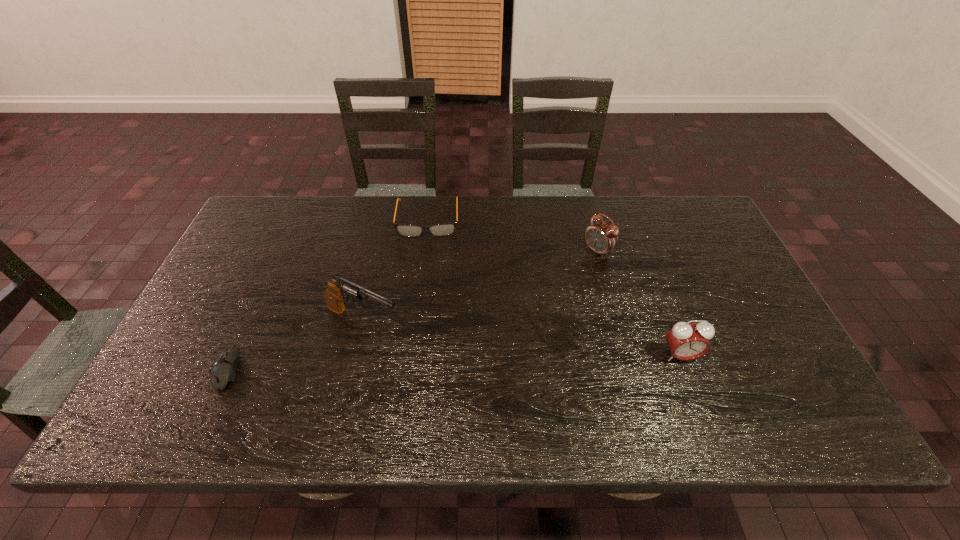
You are a GUI agent. You are given a task and a screenshot of the screen. Output one action in this format:
    pyautogui.click(x=<x>, y=<y>)
    Task: Click on the vacant space at the far left corner of the desktop
    
    Given the screenshot: What is the action you would take?
    pyautogui.click(x=283, y=233)

In the image, there is a desktop. Where is `vacant space at the far right corner`? Image resolution: width=960 pixels, height=540 pixels. vacant space at the far right corner is located at coordinates (673, 197).

Identify the location of vacant space in between the third farthest object and the second farthest object. (480, 286).

Locate an element on the screen. The width and height of the screenshot is (960, 540). unoccupied position between the gun and the rightmost object is located at coordinates (522, 339).

This screenshot has width=960, height=540. I want to click on free space between the farther alarm clock and the nearer alarm clock, so click(639, 303).

Where is `free space between the right alarm clock and the spectacles`? Image resolution: width=960 pixels, height=540 pixels. free space between the right alarm clock and the spectacles is located at coordinates (554, 287).

Identify the location of vacant area that lies between the farther alarm clock and the third farthest object. (480, 286).

Find the location of a particular element. The width and height of the screenshot is (960, 540). empty space between the fourth nearest object and the rightmost object is located at coordinates (639, 303).

I want to click on free spot between the right alarm clock and the leftmost object, so click(454, 361).

Where is `free space that is in between the leftmost object and the right alarm clock`? free space that is in between the leftmost object and the right alarm clock is located at coordinates (454, 361).